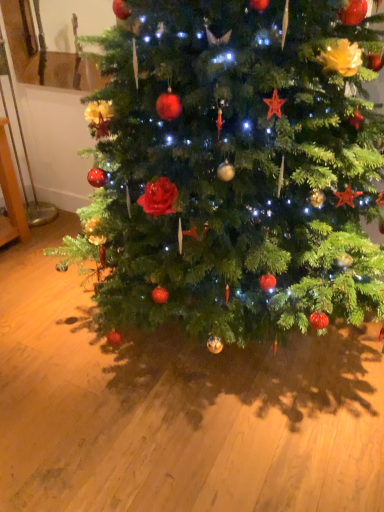
What do you see at coordinates (235, 167) in the screenshot? I see `green matte christmas tree at center` at bounding box center [235, 167].

The height and width of the screenshot is (512, 384). What are the coordinates of `green matte christmas tree at center` in the screenshot? It's located at point(235,167).

Measure the distance between point (370, 152) and camera.

They are 1.34 meters apart.

Measure the distance between green matte christmas tree at center and camera.

The distance of green matte christmas tree at center from camera is 3.78 feet.

Where is `green matte christmas tree at center`? This screenshot has height=512, width=384. green matte christmas tree at center is located at coordinates (235, 167).